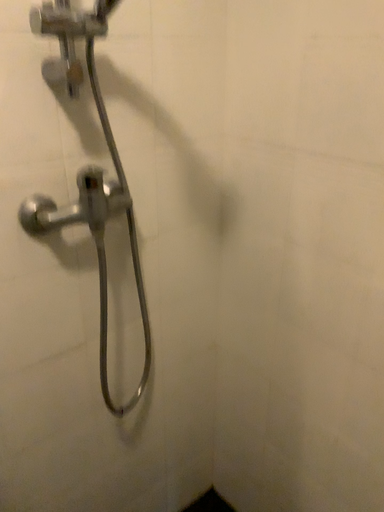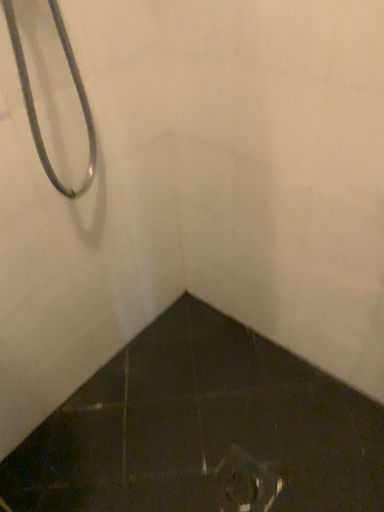
Question: Which way did the camera rotate in the video?

Choices:
 (A) rotated downward
 (B) rotated upward

Answer: (A)